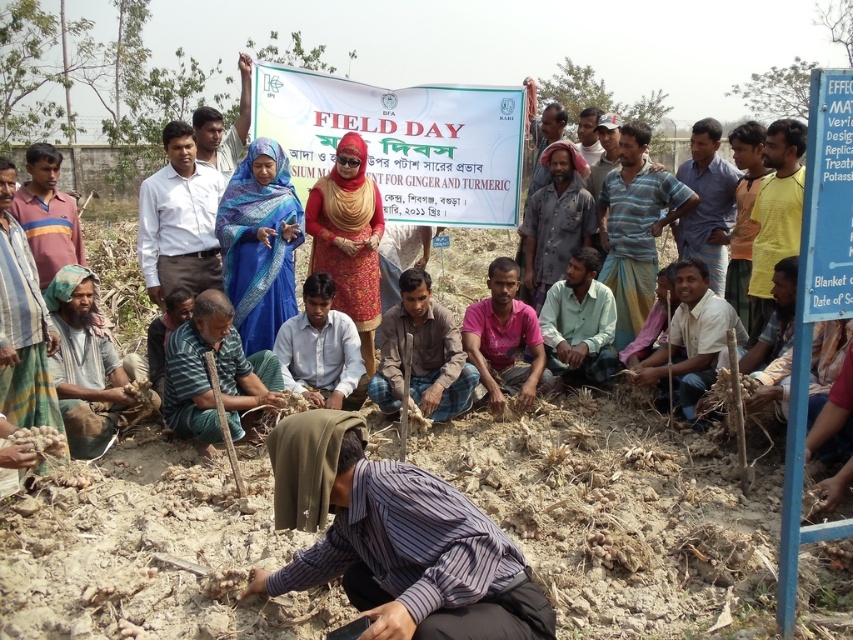
Question: Is red satin dress at center below brown wooden stick at lower right?

Choices:
 (A) no
 (B) yes

Answer: (A)

Question: From the image, what is the correct spatial relationship of blue plastic sign at right in relation to red satin dress at center?

Choices:
 (A) below
 (B) above

Answer: (A)

Question: Among these objects, which one is farthest from the camera?

Choices:
 (A) gray fabric cloth at lower left
 (B) brown rough plant at lower left
 (C) pink fabric at center

Answer: (B)

Question: Is red satin dress at center to the left of plaid fabric shirt at center from the viewer's perspective?

Choices:
 (A) yes
 (B) no

Answer: (A)

Question: Among these points, which one is nearest to the camera?

Choices:
 (A) (x=498, y=387)
 (B) (x=154, y=499)
 (C) (x=315, y=300)

Answer: (B)

Question: Which of these objects is positioned closest to the brown soil at center?

Choices:
 (A) brown wooden stick at lower right
 (B) blue printed saree at center
 (C) brown wooden stick at center
 (D) brown rough plant at lower left

Answer: (A)